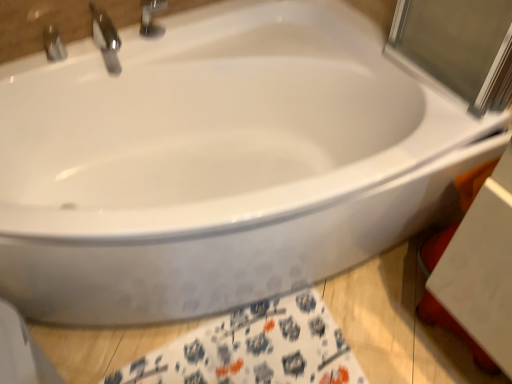
The height and width of the screenshot is (384, 512). Identify the location of blank space situated above white fabric towel at lower center (from a real-world perspective). [268, 353].